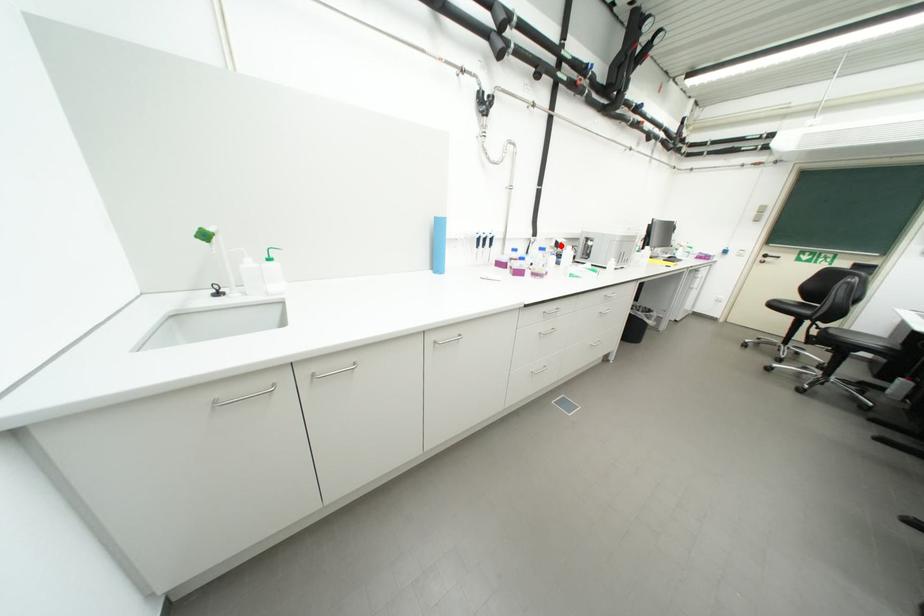
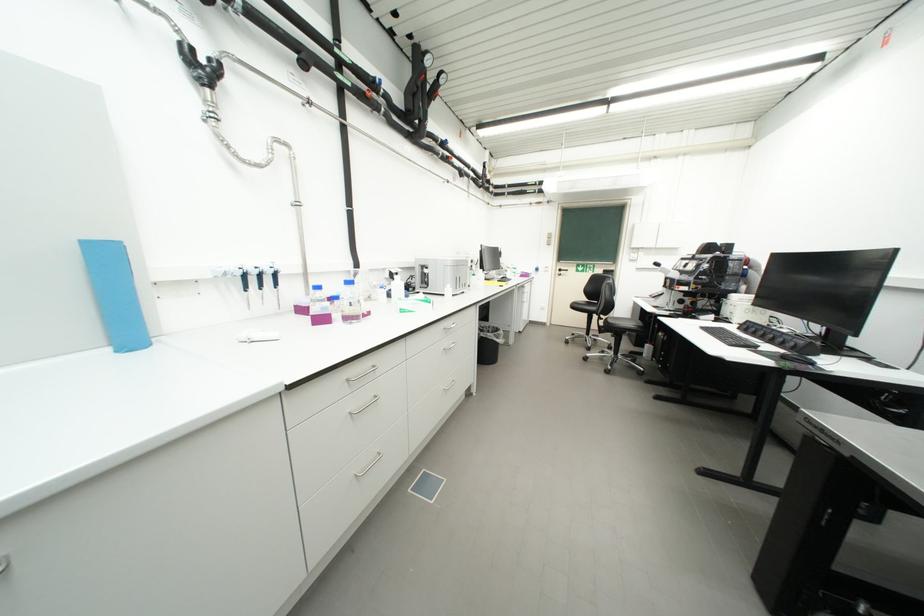
The point at the highlighted location is marked in the first image. Where is the corresponding point in the second image?

(395, 277)